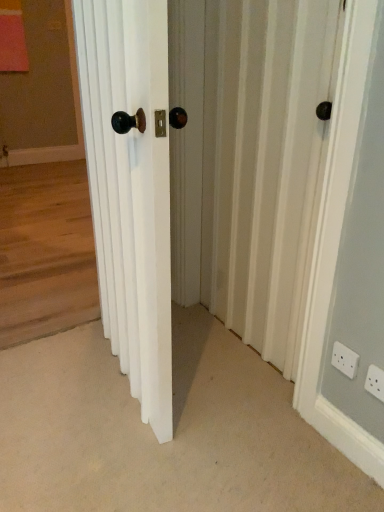
Question: Considering the relative sizes of white plastic electric outlet at lower right, which is the second electric outlet from front to back, and white plastic electric outlet at lower right, the second electric outlet when ordered from back to front, in the image provided, is white plastic electric outlet at lower right, which is the second electric outlet from front to back, shorter than white plastic electric outlet at lower right, the second electric outlet when ordered from back to front,?

Choices:
 (A) no
 (B) yes

Answer: (B)

Question: From the image's perspective, would you say white plastic electric outlet at lower right, the first electric outlet from the back, is positioned over white plastic electric outlet at lower right, placed as the first electric outlet when sorted from front to back?

Choices:
 (A) yes
 (B) no

Answer: (A)

Question: Considering the relative positions of white plastic electric outlet at lower right, the first electric outlet from the back, and white plastic electric outlet at lower right, placed as the first electric outlet when sorted from front to back, in the image provided, is white plastic electric outlet at lower right, the first electric outlet from the back, in front of white plastic electric outlet at lower right, placed as the first electric outlet when sorted from front to back,?

Choices:
 (A) no
 (B) yes

Answer: (A)

Question: Does white plastic electric outlet at lower right, which is the second electric outlet from front to back, have a smaller size compared to white plastic electric outlet at lower right, the second electric outlet when ordered from back to front?

Choices:
 (A) yes
 (B) no

Answer: (A)

Question: Does white plastic electric outlet at lower right, which is the second electric outlet from front to back, appear on the left side of white plastic electric outlet at lower right, positioned as the 1th electric outlet in right-to-left order?

Choices:
 (A) no
 (B) yes

Answer: (B)

Question: From a real-world perspective, is white plastic electric outlet at lower right, positioned as the 2th electric outlet in right-to-left order, located beneath white plastic electric outlet at lower right, the second electric outlet positioned from the left?

Choices:
 (A) yes
 (B) no

Answer: (B)

Question: Is white textured screen door at center touching white wooden door at center?

Choices:
 (A) yes
 (B) no

Answer: (B)

Question: Can you confirm if white textured screen door at center is bigger than white wooden door at center?

Choices:
 (A) yes
 (B) no

Answer: (B)

Question: Does white textured screen door at center have a greater width compared to white wooden door at center?

Choices:
 (A) no
 (B) yes

Answer: (A)

Question: Is white textured screen door at center looking in the opposite direction of white wooden door at center?

Choices:
 (A) no
 (B) yes

Answer: (B)

Question: Does white textured screen door at center have a smaller size compared to white wooden door at center?

Choices:
 (A) yes
 (B) no

Answer: (A)

Question: From the image's perspective, would you say white textured screen door at center is positioned over white wooden door at center?

Choices:
 (A) no
 (B) yes

Answer: (B)

Question: From the image's perspective, is white plastic electric outlet at lower right, the second electric outlet when ordered from back to front, located above white textured screen door at center?

Choices:
 (A) no
 (B) yes

Answer: (A)